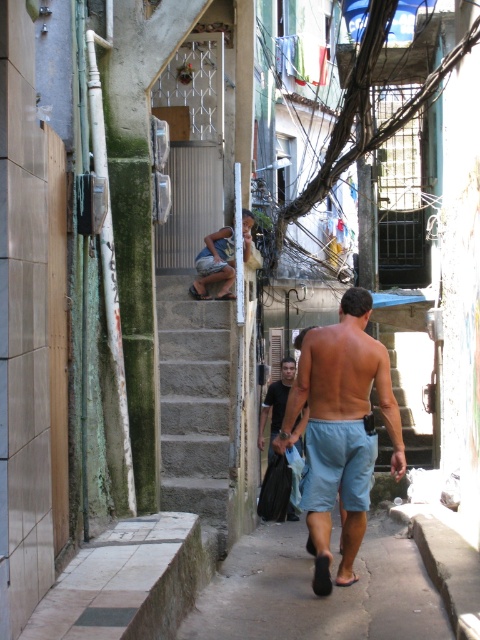
Question: Where is gray concrete pavement at lower center located in relation to gray concrete stairs at center in the image?

Choices:
 (A) left
 (B) right

Answer: (B)

Question: Does gray concrete stairs at center come in front of light blue denim shorts at center?

Choices:
 (A) yes
 (B) no

Answer: (A)

Question: Which object is closer to the camera taking this photo?

Choices:
 (A) light blue cotton shorts at center
 (B) light blue denim shorts at center

Answer: (A)

Question: Which point appears closest to the camera in this image?

Choices:
 (A) (381, 628)
 (B) (210, 241)
 (C) (359, 392)

Answer: (A)

Question: Which object appears farthest from the camera in this image?

Choices:
 (A) light blue denim shorts at center
 (B) gray concrete stairs at center
 (C) gray concrete pavement at lower center
 (D) light blue cotton shorts at center

Answer: (A)

Question: Is light blue cotton shorts at center above dark blue shorts at center?

Choices:
 (A) yes
 (B) no

Answer: (B)